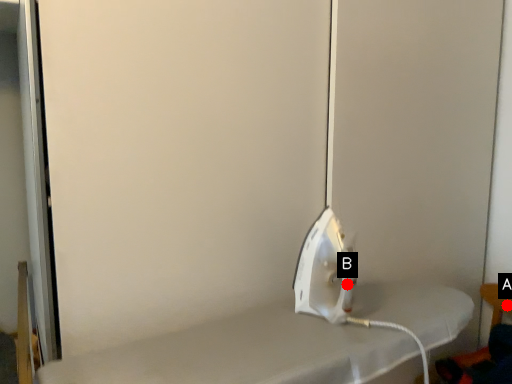
Question: Two points are circled on the image, labeled by A and B beside each circle. Which point is farther from the camera taking this photo?

Choices:
 (A) A is further
 (B) B is further

Answer: (A)